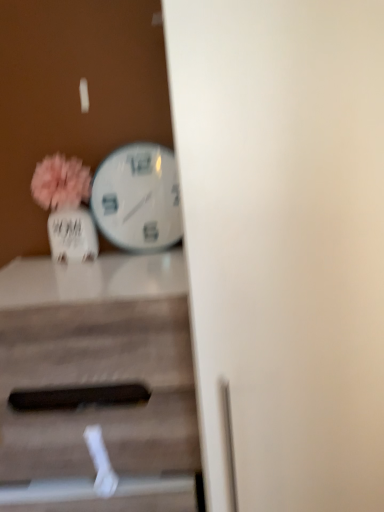
Question: Considering the positions of matte white vase at left and white glossy wall clock at center-left in the image, is matte white vase at left taller or shorter than white glossy wall clock at center-left?

Choices:
 (A) short
 (B) tall

Answer: (A)

Question: Is point (48, 181) positioned closer to the camera than point (150, 224)?

Choices:
 (A) closer
 (B) farther

Answer: (A)

Question: Which object is positioned farthest from the matte white vase at left?

Choices:
 (A) wooden table at center
 (B) white glossy wall clock at center-left

Answer: (A)

Question: Which of these objects is positioned closest to the matte white vase at left?

Choices:
 (A) white glossy wall clock at center-left
 (B) wooden table at center

Answer: (A)